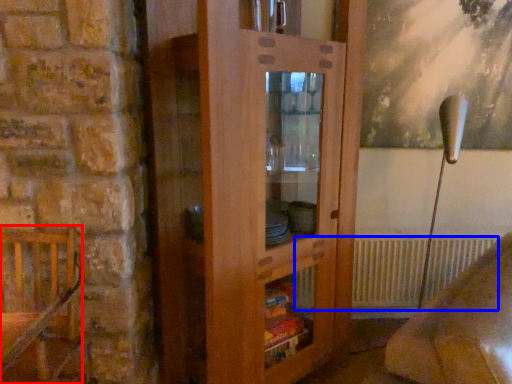
Question: Which of the following is the closest to the observer, furniture (highlighted by a red box) or radiator (highlighted by a blue box)?

Choices:
 (A) furniture
 (B) radiator

Answer: (A)